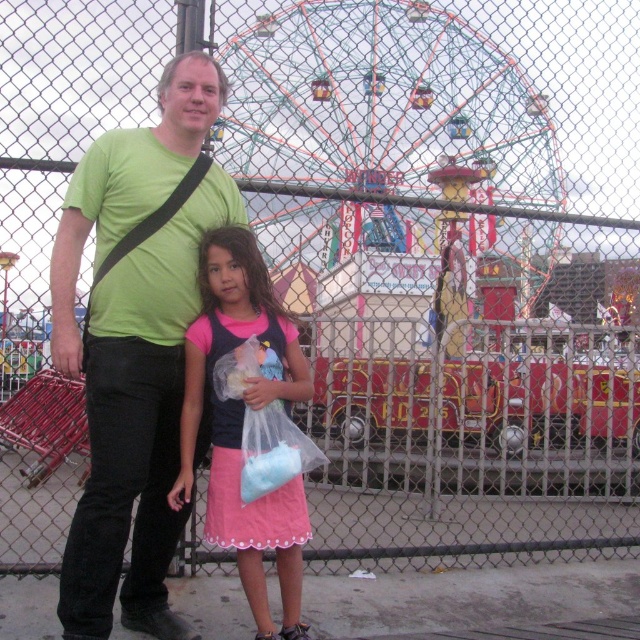
Question: Which point is closer to the camera taking this photo?

Choices:
 (A) (140, 369)
 (B) (186, 358)

Answer: (A)

Question: Can you confirm if green matte t-shirt at center is bigger than pink satin dress at center?

Choices:
 (A) yes
 (B) no

Answer: (A)

Question: Which object appears farthest from the camera in this image?

Choices:
 (A) pink satin dress at center
 (B) green matte t-shirt at center

Answer: (A)

Question: Does green matte t-shirt at center appear on the left side of pink satin dress at center?

Choices:
 (A) no
 (B) yes

Answer: (B)

Question: Which point is farther to the camera?

Choices:
 (A) pink satin dress at center
 (B) green matte t-shirt at center

Answer: (A)

Question: Can you confirm if green matte t-shirt at center is thinner than pink satin dress at center?

Choices:
 (A) no
 (B) yes

Answer: (A)